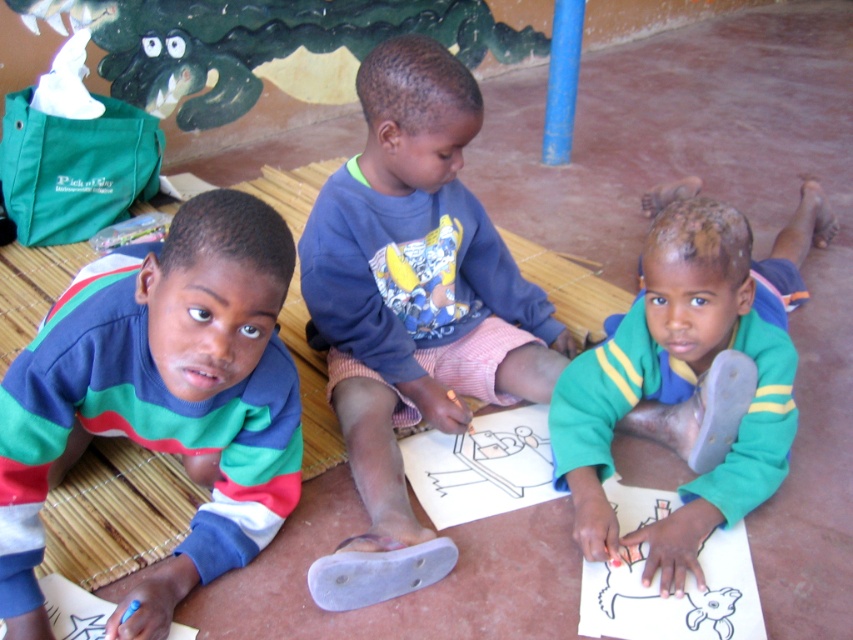
You are a photographer standing in front of the children. You notice the multicolored striped sweater at left and the blue cotton shirt at center. Which clothing item is positioned lower from your viewpoint?

The multicolored striped sweater at left is located below the blue cotton shirt at center, so it is positioned lower from your viewpoint.